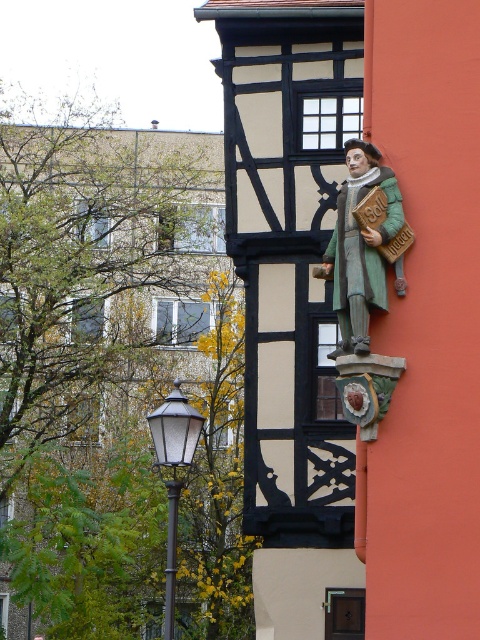
You are an architect designing a new building inspired by medieval architecture. You want to place a small garden statue that is exactly the same height as the metallic pole at lower left. Given the green carved wood figure at center, can you determine if it will be the right size for your design?

The green carved wood figure at center is shorter than the metallic pole at lower left, so it will not be the right size for the design since it is shorter than the required height.

Based on the photo, you are standing in front of the building and need to determine which object is taller between the green carved wood figure at center and the matte black lamp post at lower left. Based on their positions, which one is taller?

The matte black lamp post at lower left is taller than the green carved wood figure at center.

You are an architect analyzing the building depicted in the scene. You notice the green carved wood figure at center. Based on its position relative to the half timbered section and the orange wall, can you determine which wall the figure is mounted on?

The green carved wood figure at center is located at point coordinates that place it on the orange wall, as the orange wall is to the right of the half timbered section.